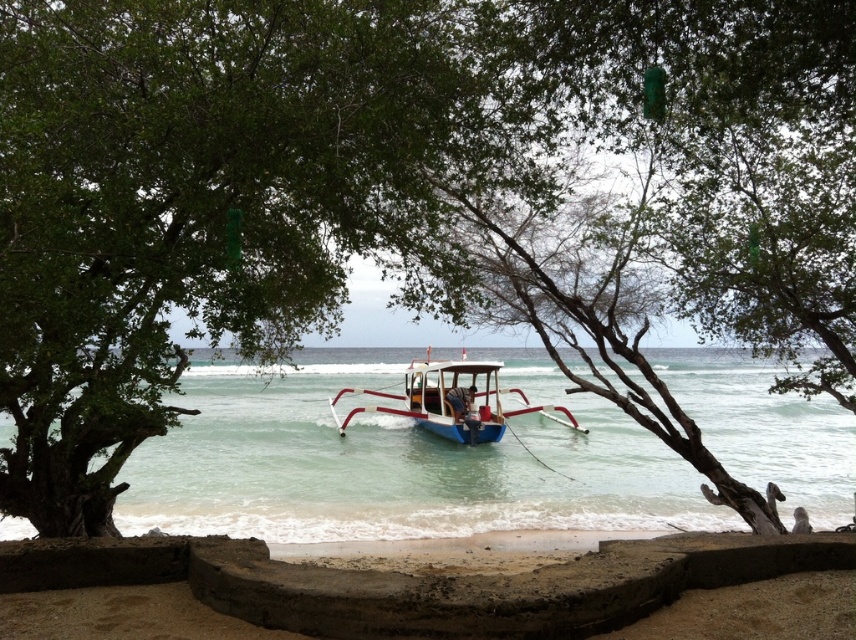
You are standing on the beach and want to take a photo of the blue painted wood boat at center. The blue water at center is in the way. Can you move closer to the boat to get a better shot without the water blocking the view?

The blue water at center is closer to the viewer than the blue painted wood boat at center, so moving closer to the boat might not help as the water is already in front of it. You may need to adjust your angle or position to avoid the water blocking the view.

Looking at this image, you are standing on the beach and want to walk from point A to point B. Point A is at coordinates point (325, 483) and point B is at coordinates point (434, 378). Which direction should you walk to reach point B from point A?

To reach point B from point A, you should walk backward since point A is in front of point B according to their coordinates.